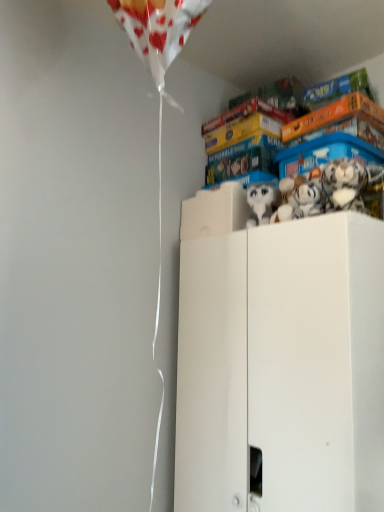
Question: Based on their sizes in the image, would you say white plush toy at upper right, which is the second toy in left-to-right order, is bigger or smaller than white plush toy at upper center, which is the third toy from right to left?

Choices:
 (A) big
 (B) small

Answer: (B)

Question: Considering the positions of white plush toy at upper right, the second toy from the right, and white plush toy at upper center, which appears as the first toy when viewed from the left, in the image, is white plush toy at upper right, the second toy from the right, wider or thinner than white plush toy at upper center, which appears as the first toy when viewed from the left,?

Choices:
 (A) thin
 (B) wide

Answer: (B)

Question: Which is farther from the white plush toy at upper right, which is the third toy from left to right?

Choices:
 (A) white plush toy at upper right, which is the second toy in left-to-right order
 (B) white plush toy at upper center, which appears as the first toy when viewed from the left
 (C) white matte cabinet at upper right

Answer: (C)

Question: Which of these objects is positioned closest to the white plush toy at upper right, which is the second toy in left-to-right order?

Choices:
 (A) white matte cabinet at upper right
 (B) white plush toy at upper right, which is the third toy from left to right
 (C) white plush toy at upper center, which is the third toy from right to left

Answer: (B)